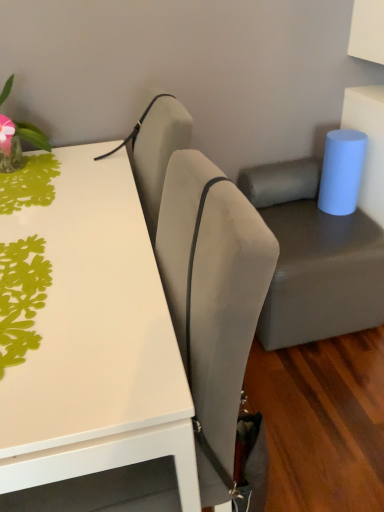
Where is `free space to the right of green paper cutout at upper left, the second plant from the top`? This screenshot has height=512, width=384. free space to the right of green paper cutout at upper left, the second plant from the top is located at coordinates (109, 303).